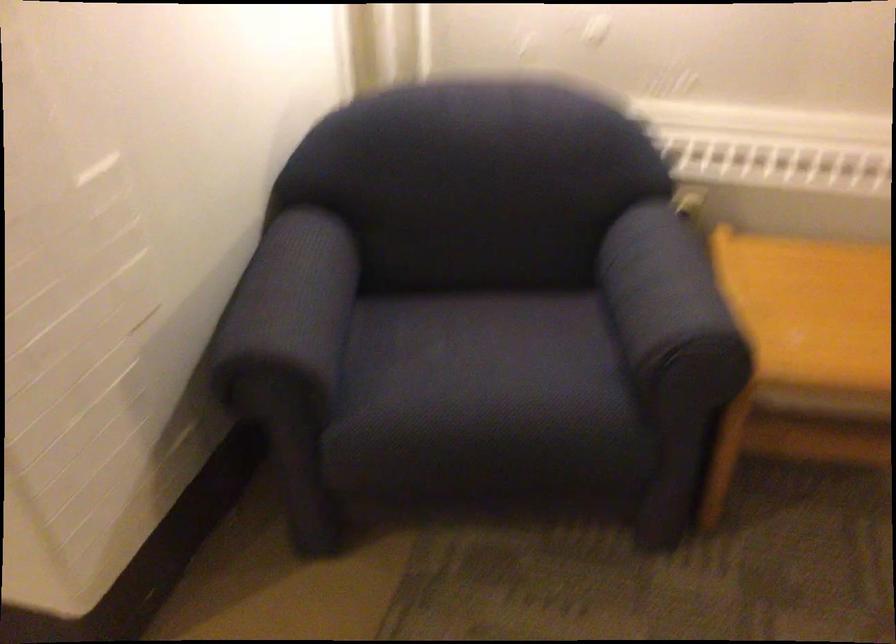
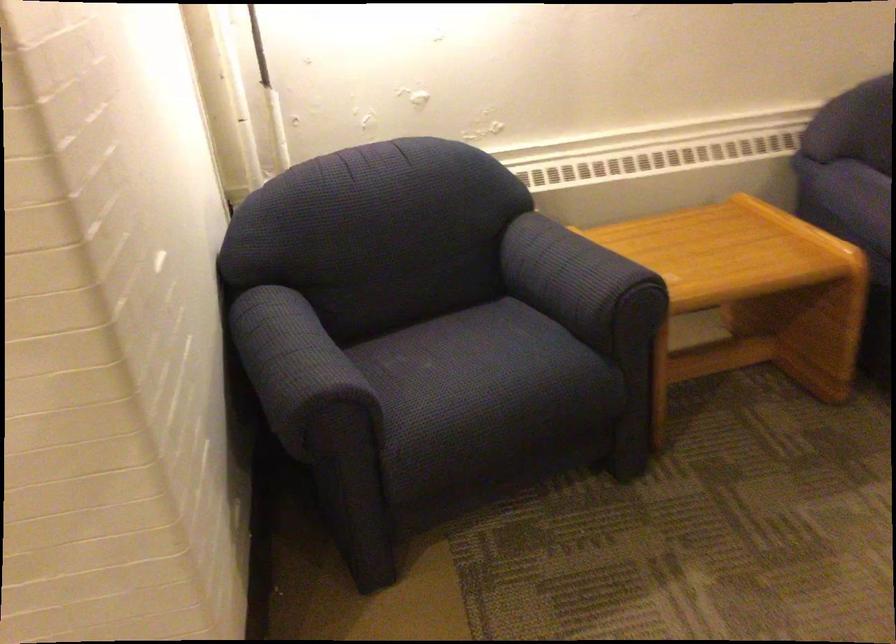
Find the pixel in the second image that matches [254,308] in the first image.

(294, 363)